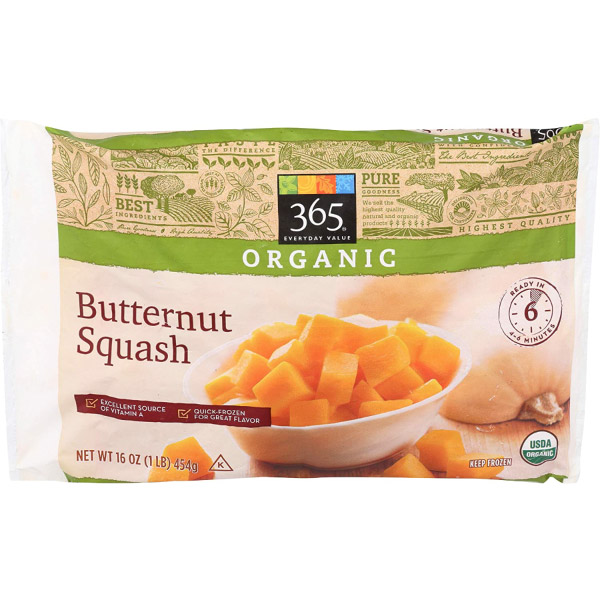
Identify the location of white bowl. (355, 446).